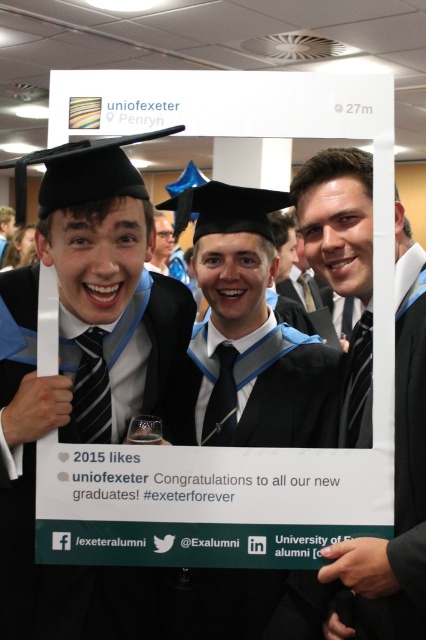
You are a photographer at the graduation event and need to adjust the lighting to ensure both the matte black graduation cap at left and the matte black suit at center are well lit. Since black absorbs light, which object might require more lighting adjustments to avoid appearing too dark?

The matte black graduation cap at left might require more lighting adjustments because it is wider than the matte black suit at center, meaning it could cast larger shadows or need more even illumination to prevent appearing overly dark.

You are a photographer trying to capture a group photo of the matte black graduation cap at left and the matte black suit at center. The camera you are using has a minimum focus distance of 18 inches. Can you take a clear photo of both objects without moving them?

The distance between the matte black graduation cap at left and the matte black suit at center is 19.36 inches, which is greater than the camera minimum focus distance of 18 inches. Therefore, you can take a clear photo of both objects without moving them.

You are a photographer standing at a distance. You want to capture a closeup shot of the matte black graduation cap at left without moving your position. Can you adjust your camera lens to focus on it clearly?

The matte black graduation cap at left is 36.32 inches away from the viewer. Since you can adjust the camera lens focus, you can capture a clear closeup shot without moving closer.